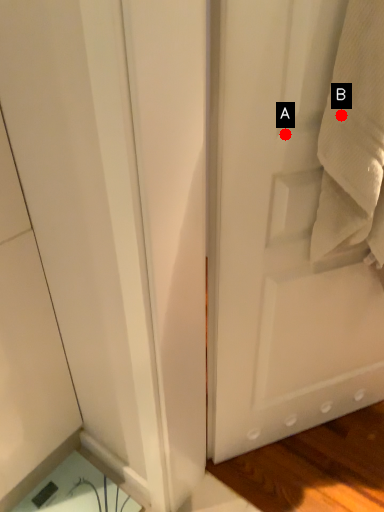
Question: Two points are circled on the image, labeled by A and B beside each circle. Which point is further to the camera?

Choices:
 (A) A is further
 (B) B is further

Answer: (A)